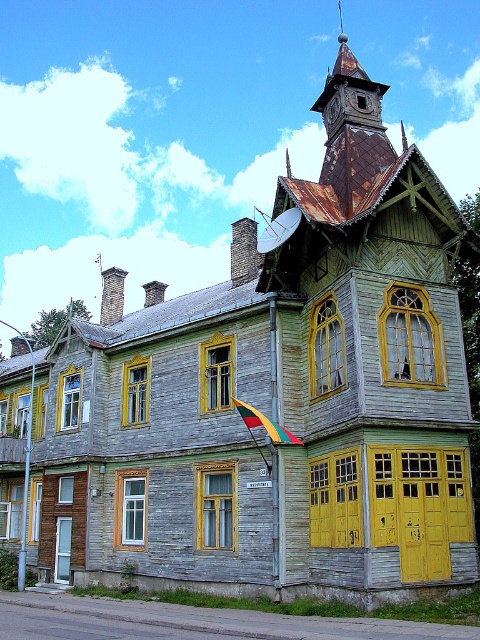
You are standing in front of the house and notice a specific point marked at coordinates (351, 145). Based on the description, where is this point located on the house?

The point is located on the rusty metal spire at upper center of the house.

You are standing at a certain point and looking at the multi story wooden house. You want to take a photo of the house from a position that is exactly 50 meters away from the point marked as point (369, 136). Is this possible?

The distance between point (369, 136) and the camera is 51.37 meters. Since 51.37 meters is more than 50 meters, you can move slightly closer to reach exactly 50 meters away from point (369, 136) to take the photo.